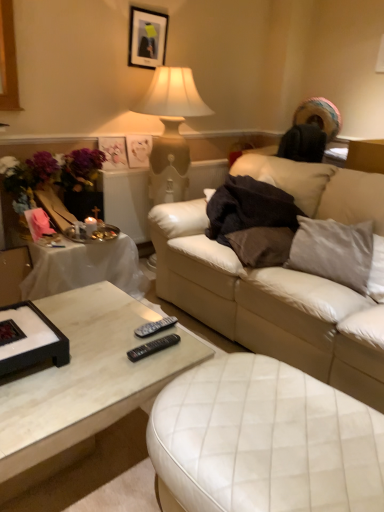
Find the location of a particular element. vacant area situated to the left side of black plastic remote at center, which is the 2th remote from front to back is located at coordinates (102, 332).